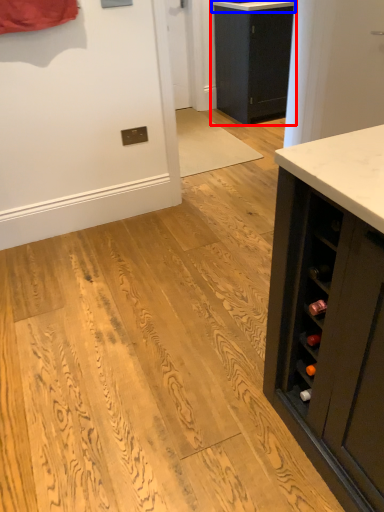
Question: Which point is closer to the camera, cabinetry (highlighted by a red box) or counter top (highlighted by a blue box)?

Choices:
 (A) cabinetry
 (B) counter top

Answer: (B)